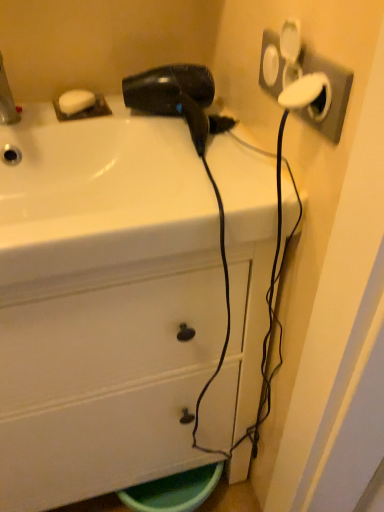
Identify the location of vacant space underneath black matte hair dryer at upper center (from a real-world perspective). (168, 128).